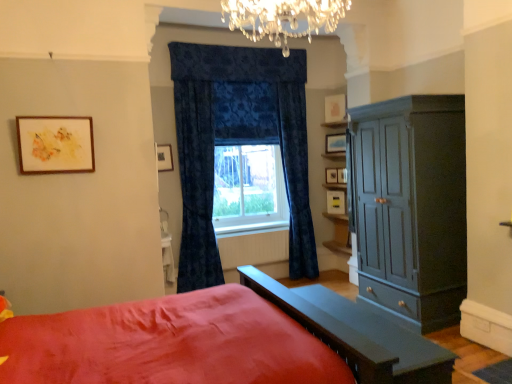
Question: In the image, is wooden picture frame at upper center, positioned as the 4th picture frame in right-to-left order, on the left side or the right side of matte gray cabinet at right?

Choices:
 (A) right
 (B) left

Answer: (B)

Question: From the image's perspective, relative to matte gray cabinet at right, is wooden picture frame at upper center, the 3th picture frame when ordered from left to right, above or below?

Choices:
 (A) below
 (B) above

Answer: (B)

Question: Based on their relative distances, which object is farther from the wooden framed artwork at upper left, placed as the first picture frame when sorted from left to right?

Choices:
 (A) velvet blue curtain at center, positioned as the 2th curtain in right-to-left order
 (B) matte gray cabinet at right
 (C) wooden picture frame at upper center, the 3th picture frame when ordered from left to right
 (D) white glossy table at lower center, which is the second table from front to back
 (E) white painted radiator at center

Answer: (C)

Question: Which object is positioned closest to the white glossy table at lower center, acting as the 2th table starting from the right?

Choices:
 (A) white matte picture frame at upper center, which ranks as the 3th picture frame in right-to-left order
 (B) matte gray table at lower center, acting as the second table starting from the back
 (C) wooden picture frame at upper right, placed as the fifth picture frame when sorted from left to right
 (D) wooden picture frame at upper center, positioned as the 4th picture frame in right-to-left order
 (E) matte gray cabinet at right

Answer: (D)